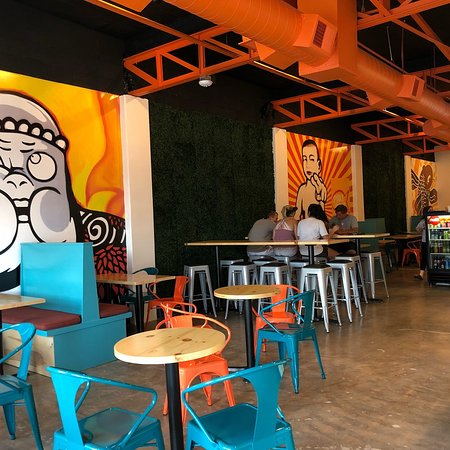
Image resolution: width=450 pixels, height=450 pixels. I want to click on floor, so click(x=381, y=391).